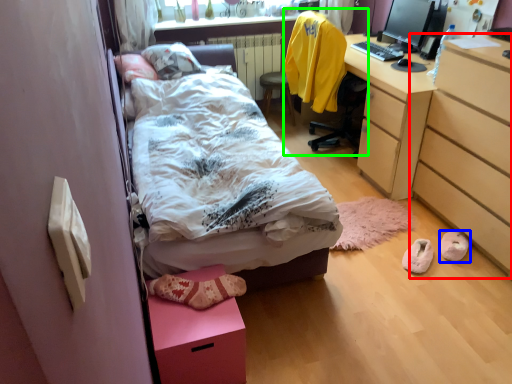
Question: Which object is the closest to the chest of drawers (highlighted by a red box)? Choose among these: footwear (highlighted by a blue box) or chair (highlighted by a green box).

Choices:
 (A) footwear
 (B) chair

Answer: (A)